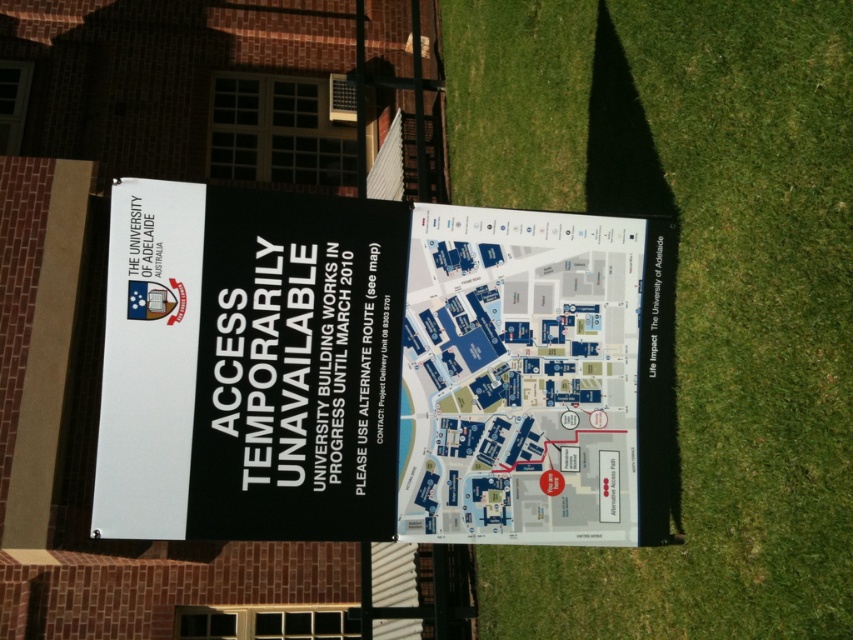
Question: Which point is closer to the camera?

Choices:
 (A) green grass at lower right
 (B) black paper sign at upper left
 (C) blue paper map at center

Answer: (A)

Question: Is green grass at lower right above black paper sign at upper left?

Choices:
 (A) no
 (B) yes

Answer: (A)

Question: From the image, what is the correct spatial relationship of green grass at lower right in relation to blue paper map at center?

Choices:
 (A) above
 (B) below

Answer: (B)

Question: Among these objects, which one is farthest from the camera?

Choices:
 (A) black paper sign at upper left
 (B) blue paper map at center

Answer: (B)

Question: Does black paper sign at upper left lie behind blue paper map at center?

Choices:
 (A) no
 (B) yes

Answer: (A)

Question: Which of the following is the farthest from the observer?

Choices:
 (A) blue paper map at center
 (B) black paper sign at upper left
 (C) green grass at lower right

Answer: (A)